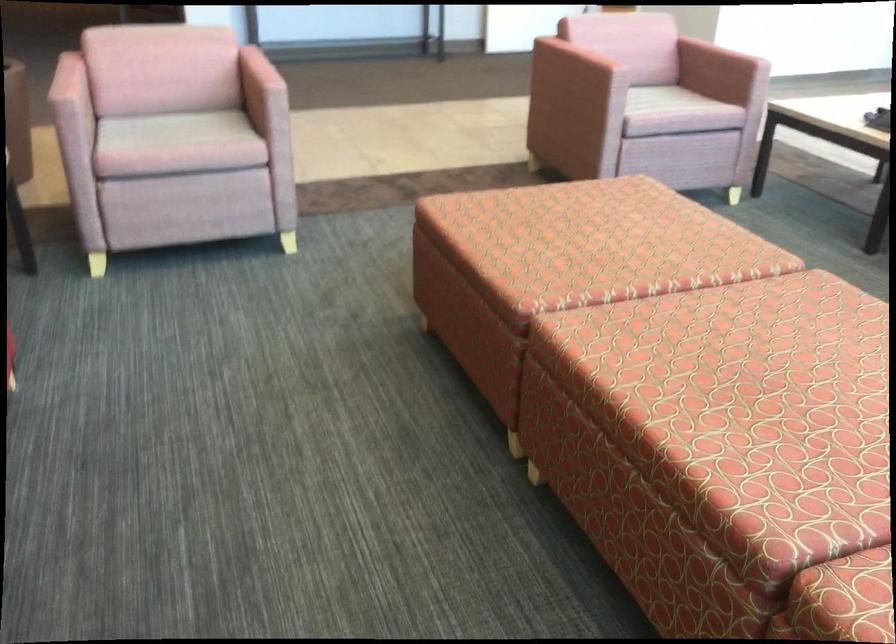
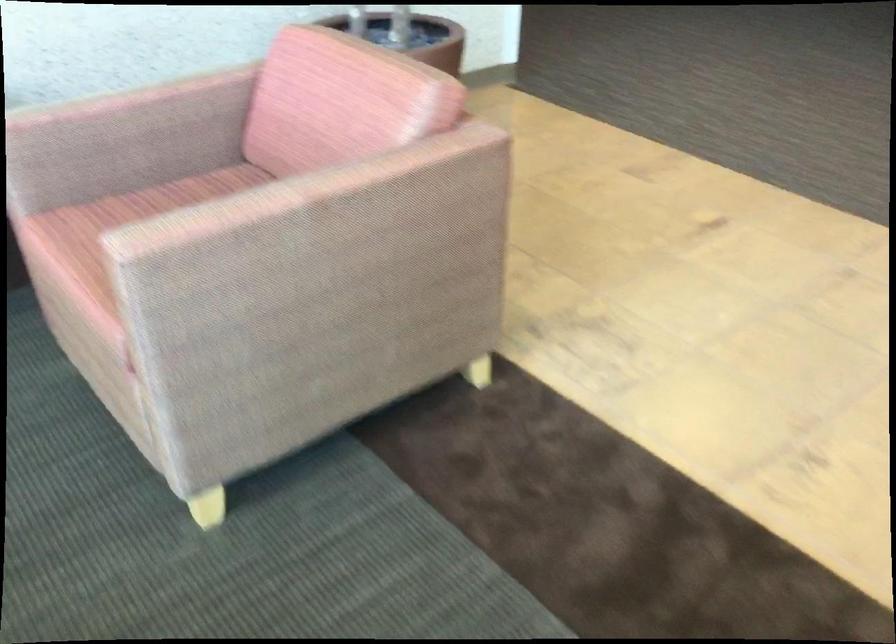
Where in the second image is the point corresponding to point (76, 77) from the first image?

(121, 98)